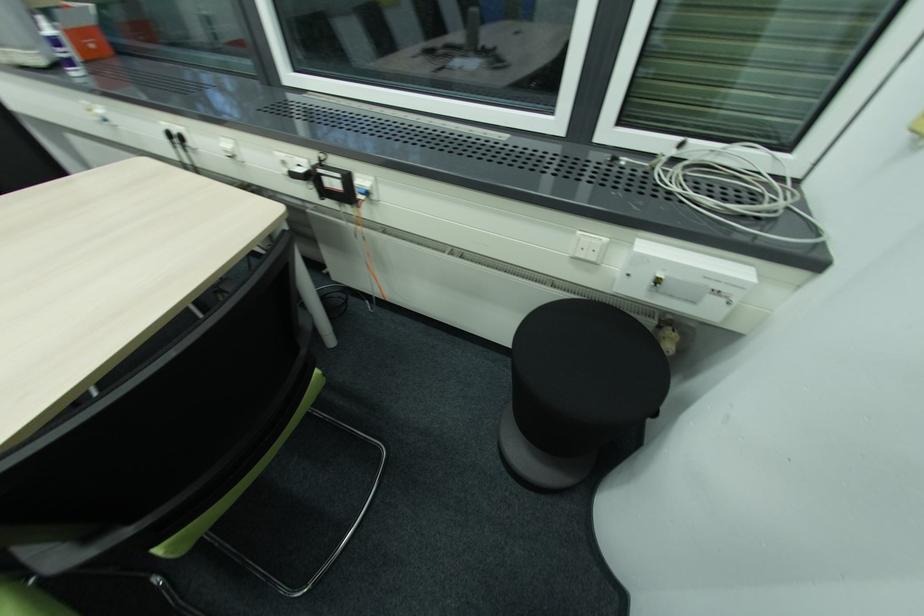
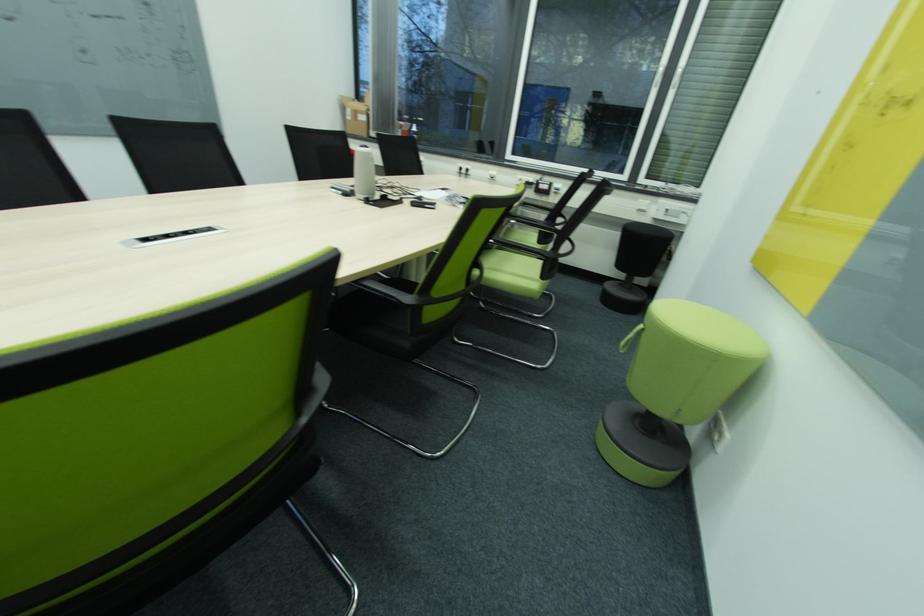
What movement of the cameraman would produce the second image?

The cameraman walked toward left, backward.